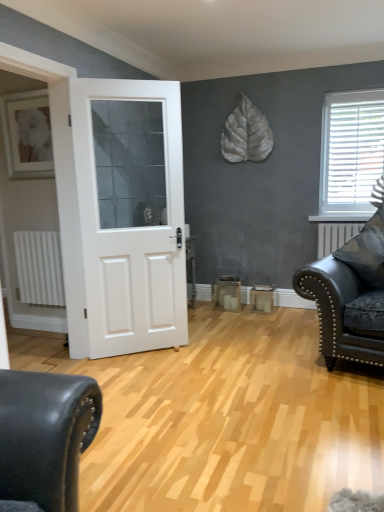
Question: Is there a large distance between white matte door at center and matte black leather couch at right?

Choices:
 (A) no
 (B) yes

Answer: (B)

Question: Does white matte door at center appear on the left side of matte black leather couch at right?

Choices:
 (A) yes
 (B) no

Answer: (A)

Question: Is white matte door at center facing towards matte black leather couch at right?

Choices:
 (A) yes
 (B) no

Answer: (B)

Question: Is white matte door at center next to matte black leather couch at right and touching it?

Choices:
 (A) yes
 (B) no

Answer: (B)

Question: Is white matte door at center facing away from matte black leather couch at right?

Choices:
 (A) no
 (B) yes

Answer: (A)

Question: Does white matte door at center appear on the right side of matte black leather couch at right?

Choices:
 (A) yes
 (B) no

Answer: (B)

Question: Is white plastic blinds at upper right thinner than matte black leather couch at right?

Choices:
 (A) no
 (B) yes

Answer: (B)

Question: Considering the relative sizes of white plastic blinds at upper right and matte black leather couch at right in the image provided, is white plastic blinds at upper right taller than matte black leather couch at right?

Choices:
 (A) yes
 (B) no

Answer: (A)

Question: Can you confirm if white plastic blinds at upper right is bigger than matte black leather couch at right?

Choices:
 (A) no
 (B) yes

Answer: (A)

Question: From a real-world perspective, is white plastic blinds at upper right positioned under matte black leather couch at right based on gravity?

Choices:
 (A) yes
 (B) no

Answer: (B)

Question: Is white plastic blinds at upper right with matte black leather couch at right?

Choices:
 (A) no
 (B) yes

Answer: (A)

Question: Could matte black leather couch at right be considered to be inside white plastic blinds at upper right?

Choices:
 (A) yes
 (B) no

Answer: (B)

Question: Does matte black leather couch at right have a lesser width compared to white plastic blinds at upper right?

Choices:
 (A) yes
 (B) no

Answer: (B)